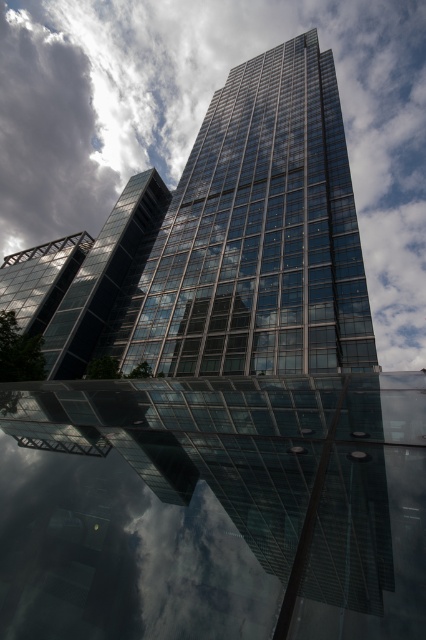
Who is lower down, transparent glass building at center or white fluffy cloud at upper center?

transparent glass building at center is lower down.

Is transparent glass building at center bigger than white fluffy cloud at upper center?

Incorrect, transparent glass building at center is not larger than white fluffy cloud at upper center.

Between point (97, 579) and point (46, 1), which one is positioned in front?

Positioned in front is point (97, 579).

Locate an element on the screen. This screenshot has height=640, width=426. transparent glass building at center is located at coordinates (210, 508).